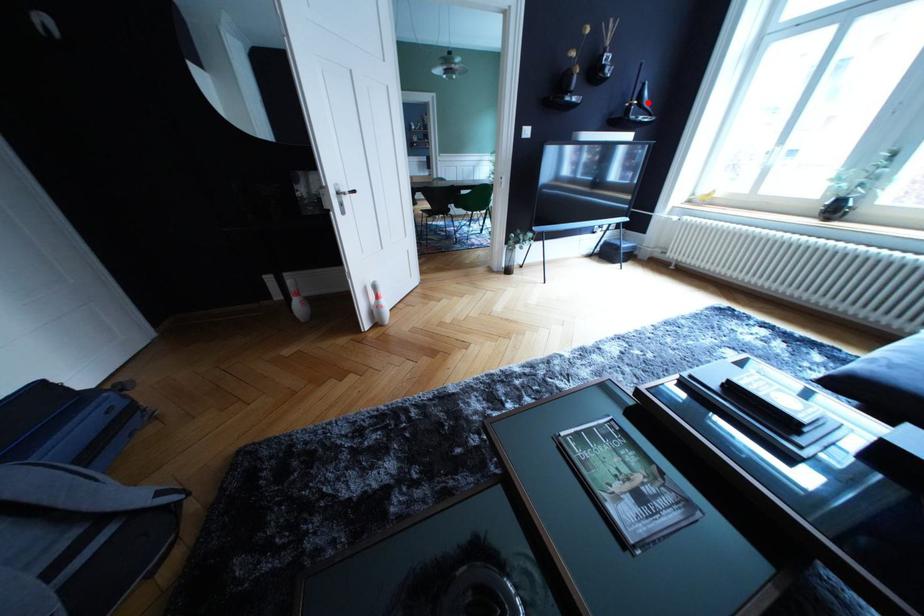
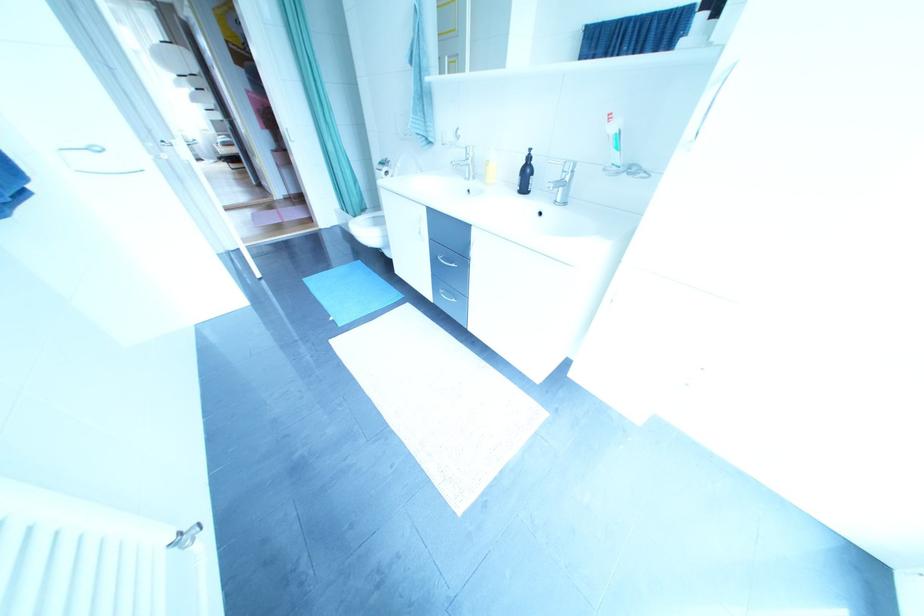
Question: I am providing you with two images of the same scene from different viewpoints. A red point is marked on the first image. Is the red point's position out of view in image 2?

Choices:
 (A) Yes
 (B) No

Answer: (A)